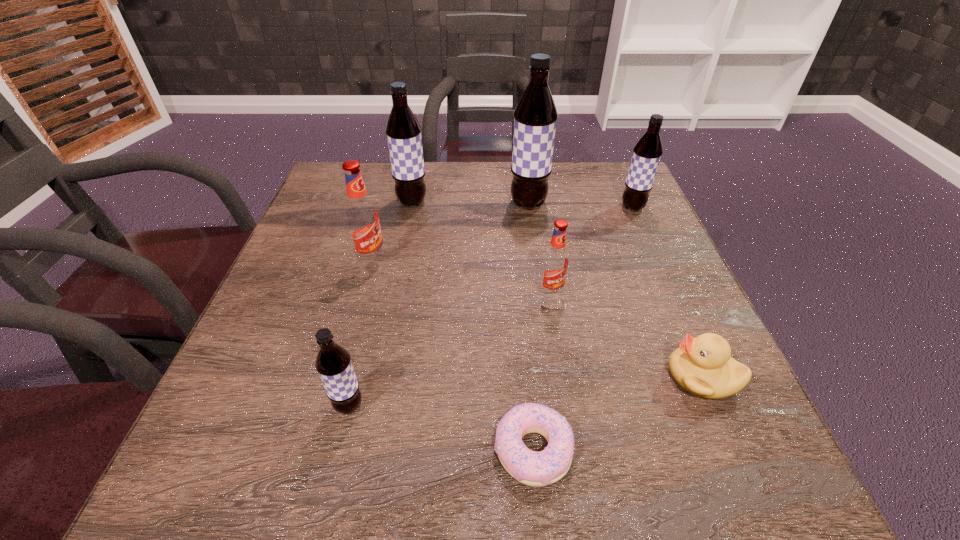
Find the location of `free space between the bigger red root beer and the right red root beer`. free space between the bigger red root beer and the right red root beer is located at coordinates tap(461, 277).

Where is `unoccupied area between the second brown root beer from right to left and the pink doughnut`? The image size is (960, 540). unoccupied area between the second brown root beer from right to left and the pink doughnut is located at coordinates (531, 327).

The height and width of the screenshot is (540, 960). Identify the location of vacant area that lies between the tallest object and the nearest brown root beer. (439, 305).

The image size is (960, 540). I want to click on empty location between the shortest object and the third nearest root beer, so click(x=452, y=355).

Image resolution: width=960 pixels, height=540 pixels. What are the coordinates of `free space between the left red root beer and the smallest brown root beer` in the screenshot? It's located at (360, 333).

Where is `free spot between the smallest brown root beer and the fourth farthest root beer`? The width and height of the screenshot is (960, 540). free spot between the smallest brown root beer and the fourth farthest root beer is located at coordinates (360, 333).

Select which object is the closest to the seventh tallest object. Please provide its 2D coordinates. Your answer should be formatted as a tuple, i.e. [(x, y)], where the tuple contains the x and y coordinates of a point satisfying the conditions above.

[(546, 467)]

Locate an element on the screen. The width and height of the screenshot is (960, 540). the fifth closest object to the second shortest object is located at coordinates (333, 363).

In order to click on root beer identified as the fourth closest to the second tallest object in this screenshot , I will do `click(647, 152)`.

Find the location of a particular element. root beer that stands as the fifth closest to the yellow duckling is located at coordinates (362, 219).